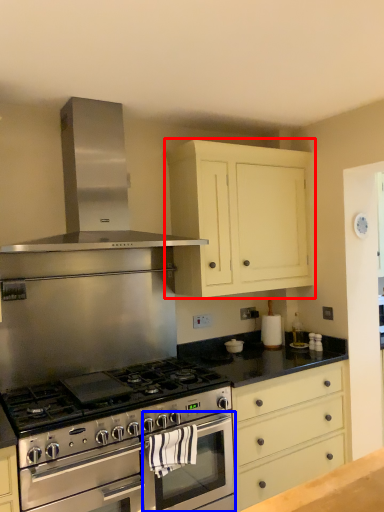
Question: Which point is further to the camera, cabinetry (highlighted by a red box) or oven (highlighted by a blue box)?

Choices:
 (A) cabinetry
 (B) oven

Answer: (A)